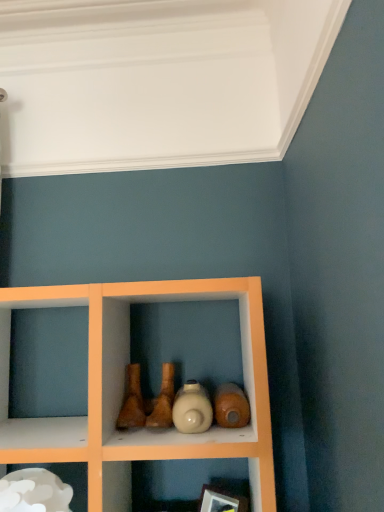
Question: Is the position of wooden picture frame at lower center more distant than that of matte beige bottle at center?

Choices:
 (A) no
 (B) yes

Answer: (B)

Question: Does wooden picture frame at lower center have a lesser width compared to matte beige bottle at center?

Choices:
 (A) no
 (B) yes

Answer: (B)

Question: Is matte beige bottle at center at the back of wooden picture frame at lower center?

Choices:
 (A) yes
 (B) no

Answer: (B)

Question: From a real-world perspective, is wooden picture frame at lower center positioned under matte beige bottle at center based on gravity?

Choices:
 (A) yes
 (B) no

Answer: (A)

Question: Is wooden picture frame at lower center at the right side of matte beige bottle at center?

Choices:
 (A) no
 (B) yes

Answer: (B)

Question: Considering their positions, is white glossy cloud at lower left located in front of or behind matte beige bottle at center?

Choices:
 (A) behind
 (B) front

Answer: (B)

Question: Is white glossy cloud at lower left situated inside matte beige bottle at center or outside?

Choices:
 (A) inside
 (B) outside

Answer: (B)

Question: Considering the positions of white glossy cloud at lower left and matte beige bottle at center in the image, is white glossy cloud at lower left bigger or smaller than matte beige bottle at center?

Choices:
 (A) big
 (B) small

Answer: (A)

Question: Does point (82, 501) appear closer or farther from the camera than point (193, 417)?

Choices:
 (A) closer
 (B) farther

Answer: (B)

Question: From the image's perspective, relative to matte beige bottle at center, is wooden picture frame at lower center above or below?

Choices:
 (A) below
 (B) above

Answer: (A)

Question: Is point (244, 509) positioned closer to the camera than point (188, 399)?

Choices:
 (A) closer
 (B) farther

Answer: (B)

Question: Based on their positions, is wooden picture frame at lower center located to the left or right of matte beige bottle at center?

Choices:
 (A) right
 (B) left

Answer: (A)

Question: From a real-world perspective, is wooden picture frame at lower center above or below matte beige bottle at center?

Choices:
 (A) below
 (B) above

Answer: (A)

Question: From the image's perspective, is matte beige bottle at center above or below wooden picture frame at lower center?

Choices:
 (A) below
 (B) above

Answer: (B)

Question: Is matte beige bottle at center spatially inside wooden picture frame at lower center, or outside of it?

Choices:
 (A) outside
 (B) inside

Answer: (A)